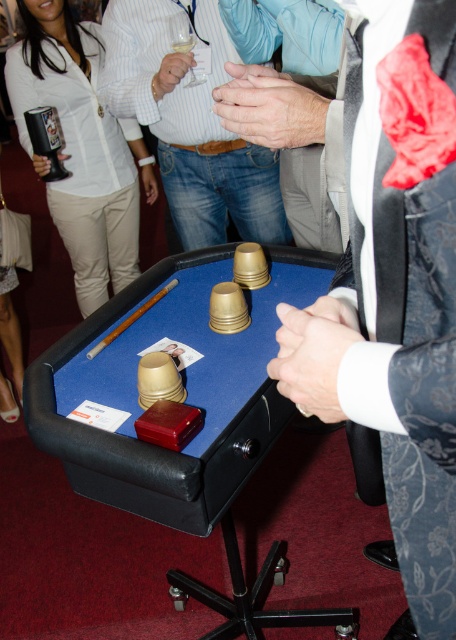
Question: Which point appears closest to the camera in this image?

Choices:
 (A) (331, 392)
 (B) (182, 65)
 (C) (279, 576)
 (D) (236, 115)

Answer: (A)

Question: Which point appears closest to the camera in this image?

Choices:
 (A) (151, 323)
 (B) (172, 70)
 (C) (409, 256)

Answer: (C)

Question: Is matte white shirt at upper center positioned at the back of matte black hand at upper left?

Choices:
 (A) no
 (B) yes

Answer: (A)

Question: Is dark gray textured suit at center below brushed metal mug at upper left?

Choices:
 (A) yes
 (B) no

Answer: (A)

Question: Is the position of brushed metal mug at upper left more distant than that of matte brown hand at center?

Choices:
 (A) no
 (B) yes

Answer: (B)

Question: Among these points, which one is farthest from the camera?

Choices:
 (A) (188, 368)
 (B) (139, 83)

Answer: (B)